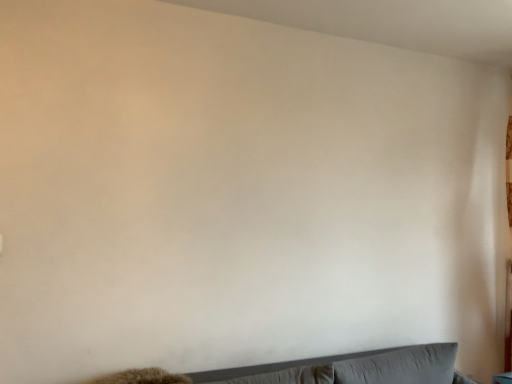
Question: Choose the correct answer: Is gray fabric pillow at lower right, arranged as the first pillow when viewed from the right, inside gray fabric pillow at lower center, the 1th pillow viewed from the left, or outside it?

Choices:
 (A) outside
 (B) inside

Answer: (A)

Question: From a real-world perspective, relative to gray fabric pillow at lower center, the 1th pillow viewed from the left, is gray fabric pillow at lower right, which appears as the second pillow when viewed from the left, vertically above or below?

Choices:
 (A) below
 (B) above

Answer: (A)

Question: Which of these objects is positioned closest to the gray fabric pillow at lower center, the 1th pillow viewed from the left?

Choices:
 (A) gray fabric pillow at lower right, arranged as the first pillow when viewed from the right
 (B) gray fabric couch at lower center

Answer: (B)

Question: Which object is positioned closest to the gray fabric pillow at lower center, the 1th pillow viewed from the left?

Choices:
 (A) gray fabric pillow at lower right, which appears as the second pillow when viewed from the left
 (B) gray fabric couch at lower center

Answer: (B)